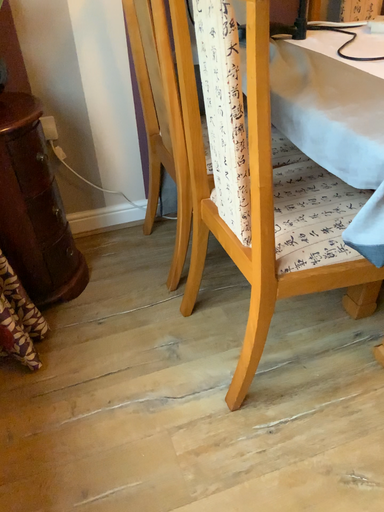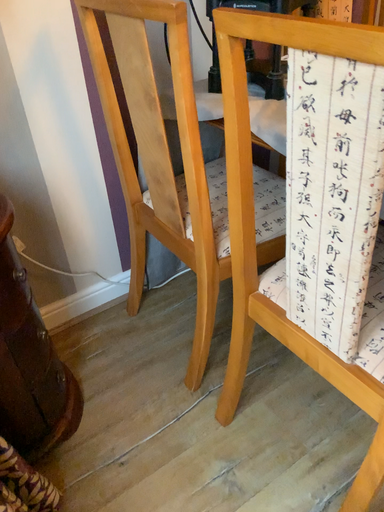
Question: How did the camera likely rotate when shooting the video?

Choices:
 (A) rotated right
 (B) rotated left

Answer: (A)